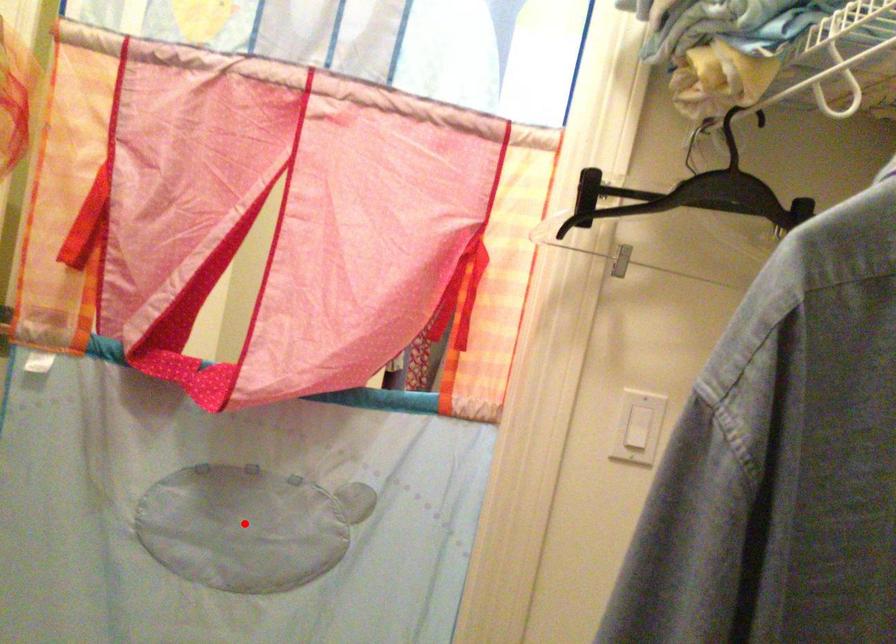
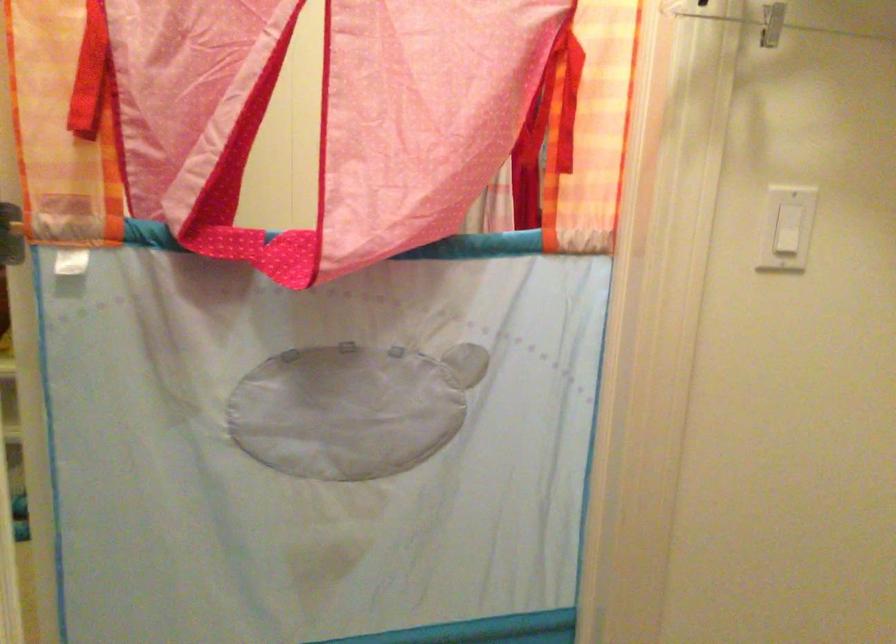
Where in the second image is the point corresponding to the highlighted location from the first image?

(351, 408)